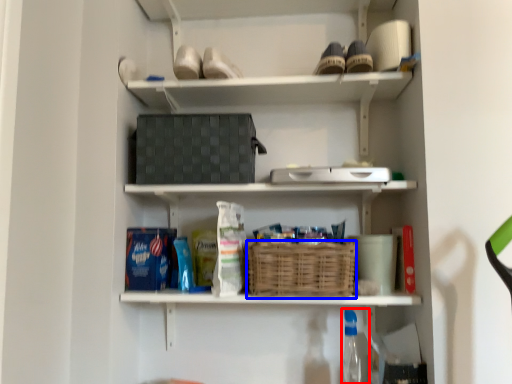
Question: Which point is further to the camera, bottle (highlighted by a red box) or basket (highlighted by a blue box)?

Choices:
 (A) bottle
 (B) basket

Answer: (A)